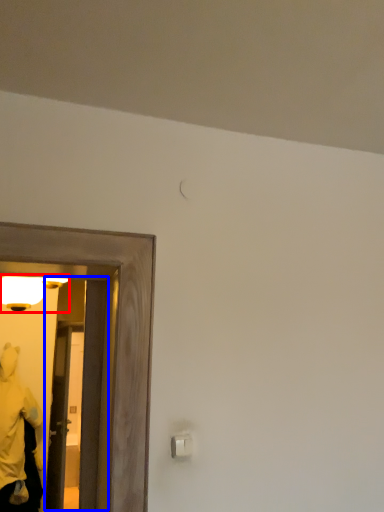
Question: Which of the following is the closest to the observer, light fixture (highlighted by a red box) or glass door (highlighted by a blue box)?

Choices:
 (A) light fixture
 (B) glass door

Answer: (A)